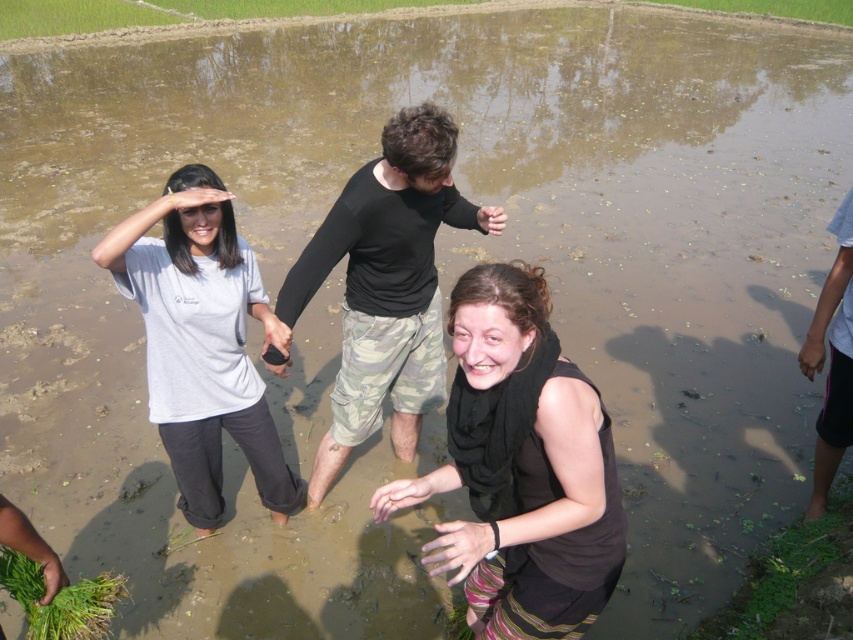
In order to click on black matte scarf at center in this screenshot , I will do `click(521, 467)`.

Does point (577, 513) come farther from viewer compared to point (187, 406)?

No, (577, 513) is in front of (187, 406).

Between point (596, 484) and point (207, 168), which one is positioned in front?

Point (596, 484) is more forward.

What are the coordinates of `black matte scarf at center` in the screenshot? It's located at 521,467.

Who is positioned more to the left, black camo pants at center or white matte shirt at left?

From the viewer's perspective, white matte shirt at left appears more on the left side.

This screenshot has width=853, height=640. I want to click on black camo pants at center, so click(386, 285).

Does point (381, 182) come closer to viewer compared to point (218, 200)?

No, it is not.

The width and height of the screenshot is (853, 640). I want to click on black camo pants at center, so click(386, 285).

Does black matte scarf at center appear under black camo pants at center?

Yes, black matte scarf at center is below black camo pants at center.

Between black matte scarf at center and black camo pants at center, which one is positioned lower?

black matte scarf at center is lower down.

Between point (577, 384) and point (393, 236), which one is positioned behind?

The point (393, 236) is behind.

The width and height of the screenshot is (853, 640). I want to click on black matte scarf at center, so click(x=521, y=467).